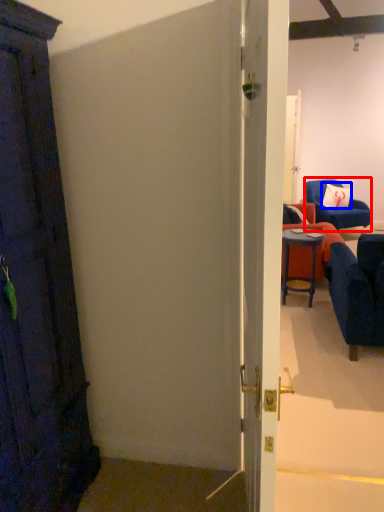
Question: Among these objects, which one is nearest to the camera, chair (highlighted by a red box) or pillow (highlighted by a blue box)?

Choices:
 (A) chair
 (B) pillow

Answer: (A)